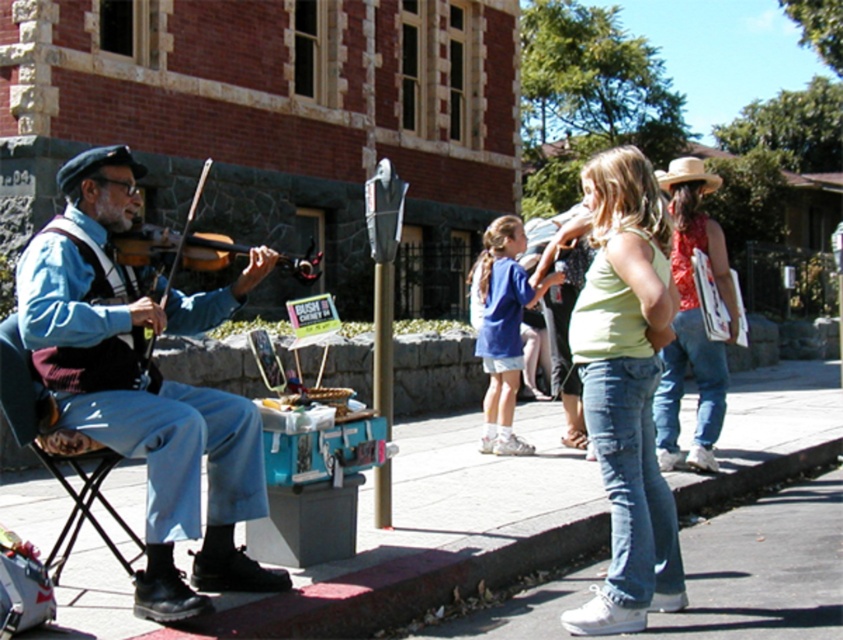
Question: Considering the real-world distances, which object is farthest from the blue denim jeans at left?

Choices:
 (A) red floral tank top at right
 (B) dark blue fabric folding chair at left
 (C) brushed metal violin at left

Answer: (A)

Question: Estimate the real-world distances between objects in this image. Which object is closer to the smooth concrete sidewalk at center?

Choices:
 (A) brushed metal violin at left
 (B) light green tank top at center

Answer: (B)

Question: Does red floral tank top at right appear under dark blue fabric folding chair at left?

Choices:
 (A) no
 (B) yes

Answer: (B)

Question: Can you confirm if smooth concrete sidewalk at center is positioned to the left of brushed metal violin at left?

Choices:
 (A) no
 (B) yes

Answer: (A)

Question: Can you confirm if light green tank top at center is positioned below dark blue fabric folding chair at left?

Choices:
 (A) no
 (B) yes

Answer: (A)

Question: Which of the following is the farthest from the observer?

Choices:
 (A) light green tank top at center
 (B) dark blue fabric folding chair at left
 (C) smooth concrete sidewalk at center
 (D) red floral tank top at right

Answer: (D)